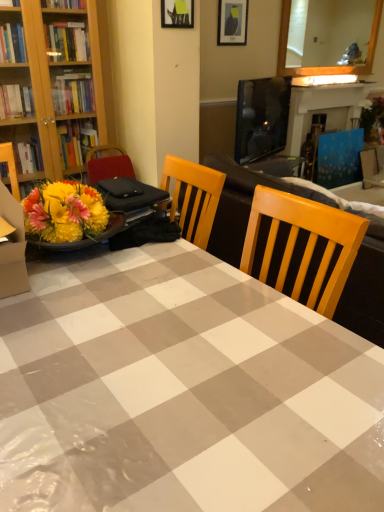
Question: Considering the relative sizes of gray checkered tablecloth at center and blue painted wood fireplace at upper right in the image provided, is gray checkered tablecloth at center thinner than blue painted wood fireplace at upper right?

Choices:
 (A) no
 (B) yes

Answer: (A)

Question: Can you confirm if gray checkered tablecloth at center is shorter than blue painted wood fireplace at upper right?

Choices:
 (A) no
 (B) yes

Answer: (B)

Question: Is gray checkered tablecloth at center to the left of blue painted wood fireplace at upper right from the viewer's perspective?

Choices:
 (A) yes
 (B) no

Answer: (A)

Question: Does gray checkered tablecloth at center have a smaller size compared to blue painted wood fireplace at upper right?

Choices:
 (A) yes
 (B) no

Answer: (B)

Question: From a real-world perspective, does gray checkered tablecloth at center stand above blue painted wood fireplace at upper right?

Choices:
 (A) no
 (B) yes

Answer: (A)

Question: Is gray checkered tablecloth at center at the right side of blue painted wood fireplace at upper right?

Choices:
 (A) yes
 (B) no

Answer: (B)

Question: Is blue fabric armchair at right positioned before gray checkered tablecloth at center?

Choices:
 (A) yes
 (B) no

Answer: (B)

Question: Could you tell me if blue fabric armchair at right is facing gray checkered tablecloth at center?

Choices:
 (A) yes
 (B) no

Answer: (B)

Question: From a real-world perspective, is blue fabric armchair at right positioned under gray checkered tablecloth at center based on gravity?

Choices:
 (A) yes
 (B) no

Answer: (B)

Question: Is blue fabric armchair at right further to the viewer compared to gray checkered tablecloth at center?

Choices:
 (A) yes
 (B) no

Answer: (A)

Question: Can you confirm if blue fabric armchair at right is smaller than gray checkered tablecloth at center?

Choices:
 (A) no
 (B) yes

Answer: (B)

Question: Can you confirm if blue fabric armchair at right is thinner than gray checkered tablecloth at center?

Choices:
 (A) no
 (B) yes

Answer: (B)

Question: Is blue painted wood fireplace at upper right thinner than blue fabric armchair at right?

Choices:
 (A) no
 (B) yes

Answer: (A)